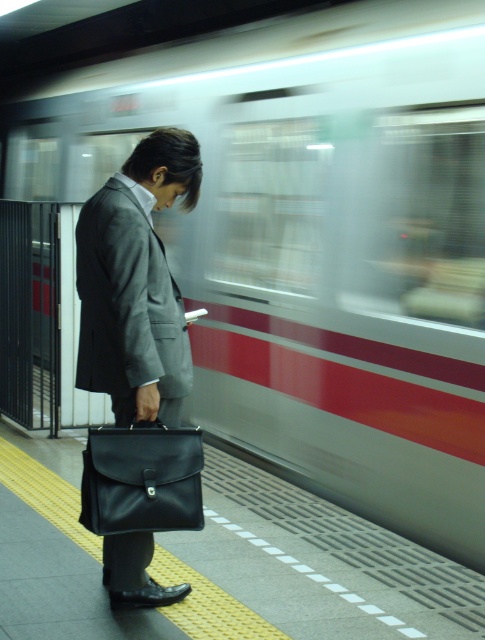
Consider the image. You are a photographer trying to capture the man in the gray matte suit at center and the black leather briefcase at lower center in the same frame. Which object should you focus on first if you want to ensure both are in focus, given that your camera can only sharply focus on one object at a time?

The gray matte suit at center is positioned on the left side of the black leather briefcase at lower center. Since the gray matte suit at center is closer to the camera, you should focus on it first to ensure both are in focus.